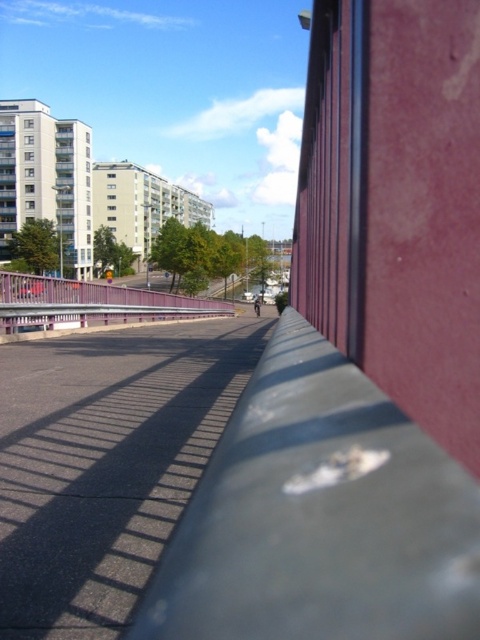
You are standing at the entrance of the pathway and want to place a small potted plant exactly where the smooth gray concrete barrier at center is located. According to the coordinates given, where should you place the potted plant?

You should place the potted plant at the coordinates point (320, 516) where the smooth gray concrete barrier at center is located.

You are a painter who needs to apply a new coat of paint to both the smooth gray concrete barrier at center and the pink metallic rail at center. If you have enough paint to cover only one of them, which one would you choose to paint first based on their widths?

The smooth gray concrete barrier at center has a lesser width compared to the pink metallic rail at center, so you should paint the pink metallic rail at center first since it requires more paint due to its greater width.